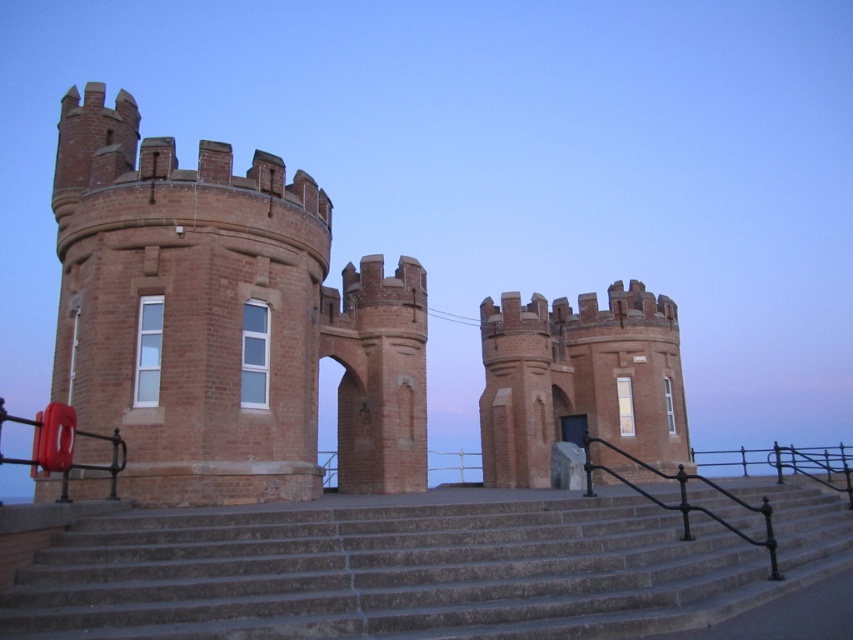
You are standing at the base of the brick tower at center. Looking straight ahead, which direction would you need to turn to face the red lifebuoy mounted on the left?

The red lifebuoy mounted on the left is located to the left side of the brick tower at center. Since you are facing the brick tower at center, turning to your left would face you towards the red lifebuoy mounted on the left.

You are standing in front of the towers and want to determine which of the two points, point (200, 312) or point (679, 564), is closer to you. Based on the scene description, which point is nearer?

Point (200, 312) is further to the viewer than point (679, 564), so the closer point is point (200, 312).